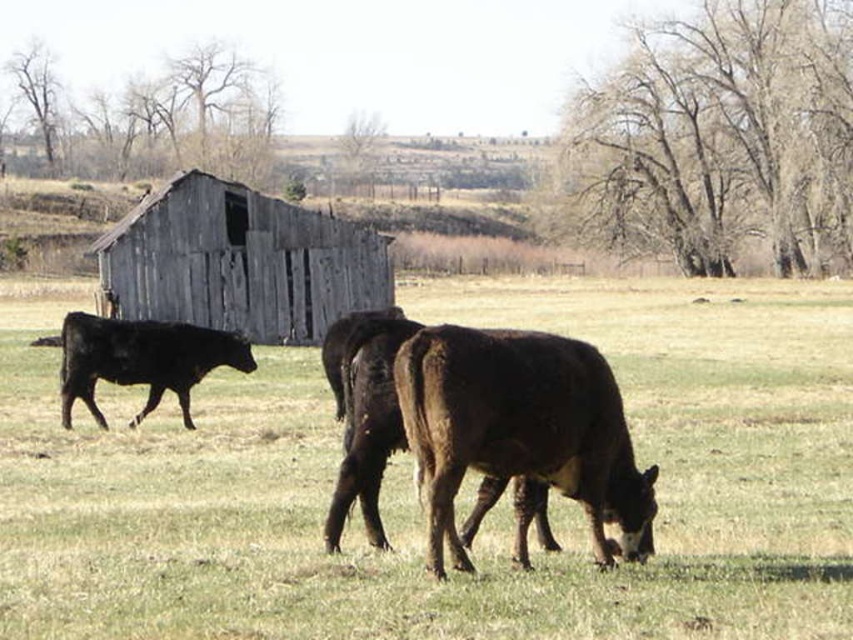
Question: Is green grass at center below brown rough textured bull at center?

Choices:
 (A) no
 (B) yes

Answer: (A)

Question: Can you confirm if brown rough textured bull at center is positioned to the left of weathered wood barn at upper left?

Choices:
 (A) yes
 (B) no

Answer: (B)

Question: Which point is farther to the camera?

Choices:
 (A) (370, 243)
 (B) (473, 376)

Answer: (A)

Question: Which is farther from the weathered wood barn at upper left?

Choices:
 (A) black smooth cow at left
 (B) brown rough textured bull at center

Answer: (B)

Question: Can you confirm if green grass at center is positioned below weathered wood barn at upper left?

Choices:
 (A) yes
 (B) no

Answer: (A)

Question: Among these points, which one is farthest from the camera?

Choices:
 (A) (148, 262)
 (B) (111, 339)

Answer: (A)